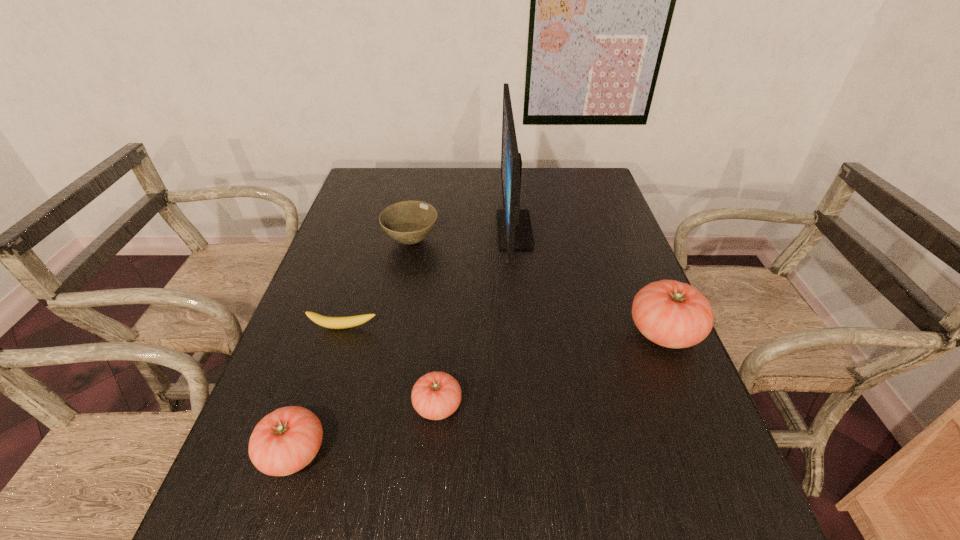
Identify the location of the second tallest tomato. The width and height of the screenshot is (960, 540). (286, 440).

Find the location of `the second shortest object`. the second shortest object is located at coordinates click(x=436, y=395).

The height and width of the screenshot is (540, 960). In order to click on the second tomato from right to left in this screenshot , I will do `click(436, 395)`.

In order to click on the second tallest object in this screenshot , I will do `click(672, 314)`.

The width and height of the screenshot is (960, 540). In order to click on the tallest tomato in this screenshot , I will do `click(672, 314)`.

The image size is (960, 540). I want to click on computer monitor, so click(x=514, y=229).

Where is `the fifth object from left to right`? The height and width of the screenshot is (540, 960). the fifth object from left to right is located at coordinates pos(514,229).

Locate an element on the screen. The width and height of the screenshot is (960, 540). bowl is located at coordinates (409, 222).

Identify the location of banana. pyautogui.click(x=351, y=321).

Identify the location of vacant space located on the right of the second tallest tomato. (353, 453).